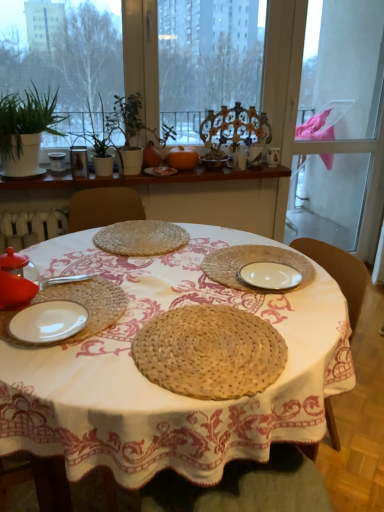
This screenshot has height=512, width=384. I want to click on free location to the right of matte glass teapot at left, the 1th tableware from the front, so click(x=92, y=298).